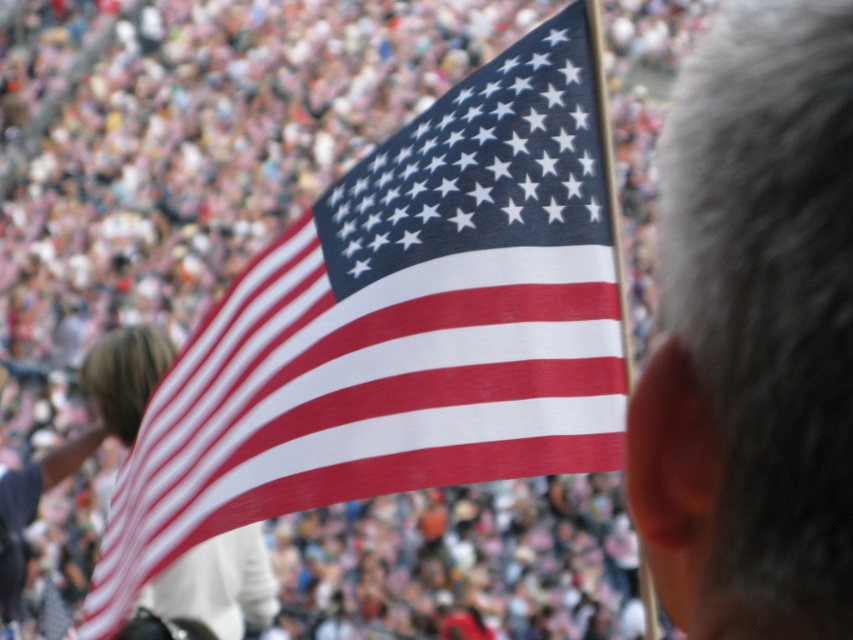
Question: In this image, where is matte fabric flag at center located relative to gray hair at upper right?

Choices:
 (A) below
 (B) above

Answer: (A)

Question: Can you confirm if matte fabric flag at center is wider than gray hair at upper right?

Choices:
 (A) no
 (B) yes

Answer: (B)

Question: Is matte fabric flag at center further to the viewer compared to gray hair at upper right?

Choices:
 (A) no
 (B) yes

Answer: (B)

Question: Which point is closer to the camera taking this photo?

Choices:
 (A) (288, 352)
 (B) (817, 296)

Answer: (B)

Question: Which point is closer to the camera?

Choices:
 (A) (300, 371)
 (B) (699, 150)

Answer: (B)